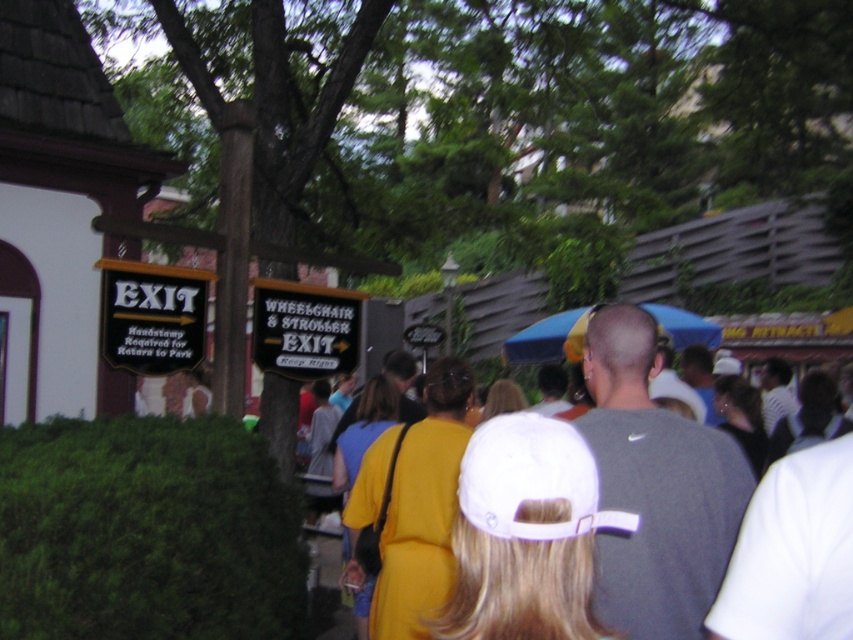
Does green leafy tree at upper left appear over gray matte shirt at center?

Yes.

Between point (610, 156) and point (654, 417), which one is positioned behind?

Point (610, 156)

Who is more forward, [795,113] or [688,513]?

Point [688,513] is more forward.

Locate an element on the screen. green leafy tree at upper left is located at coordinates (505, 120).

Does green leafy hedge at lower left appear over gray matte shirt at center?

No, green leafy hedge at lower left is not above gray matte shirt at center.

How far apart are green leafy hedge at lower left and gray matte shirt at center?

They are 1.80 meters apart.

Is point (65, 616) in front of point (602, 547)?

No, it is not.

At what (x,y) coordinates should I click in order to perform the action: click on green leafy hedge at lower left. Please return your answer as a coordinate pair (x, y). The height and width of the screenshot is (640, 853). Looking at the image, I should click on (146, 532).

Between point (210, 161) and point (486, 458), which one is positioned in front?

Positioned in front is point (486, 458).

Is point (672, 29) closer to camera compared to point (509, 525)?

No, it is not.

Image resolution: width=853 pixels, height=640 pixels. I want to click on green leafy tree at upper left, so pyautogui.click(x=505, y=120).